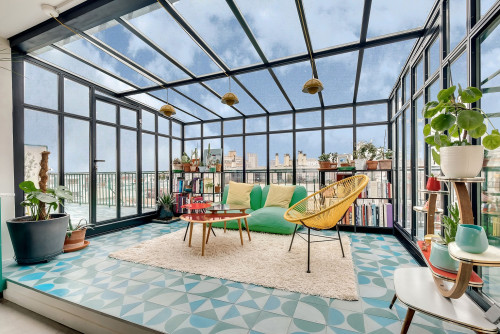
Locate an element on the screen. This screenshot has width=500, height=334. sun room is located at coordinates coord(234,310).